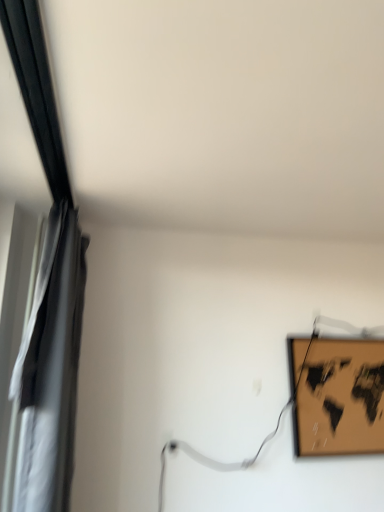
This screenshot has height=512, width=384. I want to click on wooden map at upper right, so click(337, 396).

Describe the element at coordinates (337, 396) in the screenshot. This screenshot has width=384, height=512. I see `wooden map at upper right` at that location.

From the picture: Measure the distance between point (32, 394) and camera.

Point (32, 394) is 1.36 meters from camera.

The width and height of the screenshot is (384, 512). What do you see at coordinates (46, 291) in the screenshot?
I see `silky black curtain at left` at bounding box center [46, 291].

Locate an element on the screen. This screenshot has height=512, width=384. silky black curtain at left is located at coordinates (46, 291).

At what (x,y) coordinates should I click in order to perform the action: click on wooden map at upper right. Please return your answer as a coordinate pair (x, y). Looking at the image, I should click on (337, 396).

Between wooden map at upper right and silky black curtain at left, which one appears on the right side from the viewer's perspective?

wooden map at upper right.

Looking at this image, is wooden map at upper right in front of or behind silky black curtain at left in the image?

Clearly, wooden map at upper right is behind silky black curtain at left.

Considering the points (310, 440) and (52, 330), which point is in front, point (310, 440) or point (52, 330)?

Point (52, 330)

From the image's perspective, does wooden map at upper right appear lower than silky black curtain at left?

Yes.

From a real-world perspective, is wooden map at upper right on top of silky black curtain at left?

No.

Considering the relative sizes of wooden map at upper right and silky black curtain at left in the image provided, is wooden map at upper right thinner than silky black curtain at left?

Correct, the width of wooden map at upper right is less than that of silky black curtain at left.

Who is shorter, wooden map at upper right or silky black curtain at left?

wooden map at upper right is shorter.

Considering the sizes of objects wooden map at upper right and silky black curtain at left in the image provided, who is bigger, wooden map at upper right or silky black curtain at left?

silky black curtain at left is bigger.

Is silky black curtain at left located within wooden map at upper right?

No, silky black curtain at left is not surrounded by wooden map at upper right.

Is wooden map at upper right not close to silky black curtain at left?

wooden map at upper right is positioned a significant distance from silky black curtain at left.

Is wooden map at upper right facing away from silky black curtain at left?

No.

Can you tell me how much wooden map at upper right and silky black curtain at left differ in facing direction?

There is a 85.2-degree angle between the facing directions of wooden map at upper right and silky black curtain at left.

How distant is wooden map at upper right from silky black curtain at left?

wooden map at upper right is 3.76 feet from silky black curtain at left.

Identify the location of picture frame lying behind the silky black curtain at left. Image resolution: width=384 pixels, height=512 pixels. (337, 396).

Considering the relative positions of silky black curtain at left and wooden map at upper right in the image provided, is silky black curtain at left to the left or to the right of wooden map at upper right?

silky black curtain at left is to the left of wooden map at upper right.

Which object is further away from the camera, silky black curtain at left or wooden map at upper right?

wooden map at upper right is more distant.

Which is closer, (x=81, y=319) or (x=310, y=411)?

Point (x=81, y=319) is closer to the camera than point (x=310, y=411).

From the image's perspective, between silky black curtain at left and wooden map at upper right, who is located below?

wooden map at upper right is shown below in the image.

From a real-world perspective, which object rests below the other?

wooden map at upper right.

Which of these two, silky black curtain at left or wooden map at upper right, is thinner?

wooden map at upper right.

Considering the sizes of objects silky black curtain at left and wooden map at upper right in the image provided, who is taller, silky black curtain at left or wooden map at upper right?

With more height is silky black curtain at left.

Considering the relative sizes of silky black curtain at left and wooden map at upper right in the image provided, is silky black curtain at left bigger than wooden map at upper right?

Yes, silky black curtain at left is bigger than wooden map at upper right.

In the scene shown: Is silky black curtain at left positioned beyond the bounds of wooden map at upper right?

That's correct, silky black curtain at left is outside of wooden map at upper right.

Would you consider silky black curtain at left to be distant from wooden map at upper right?

Indeed, silky black curtain at left is not near wooden map at upper right.

Is silky black curtain at left oriented towards wooden map at upper right?

Yes, silky black curtain at left faces towards wooden map at upper right.

You are a GUI agent. You are given a task and a screenshot of the screen. Output one action in this format:
    pyautogui.click(x=<x>, y=<y>)
    Task: Click on the picture frame behind the silky black curtain at left
    The width and height of the screenshot is (384, 512).
    Given the screenshot: What is the action you would take?
    pyautogui.click(x=337, y=396)

The height and width of the screenshot is (512, 384). Find the location of `picture frame below the silky black curtain at left (from the image's perspective)`. picture frame below the silky black curtain at left (from the image's perspective) is located at coordinates (337, 396).

Find the location of `picture frame below the silky black curtain at left (from a real-world perspective)`. picture frame below the silky black curtain at left (from a real-world perspective) is located at coordinates (337, 396).